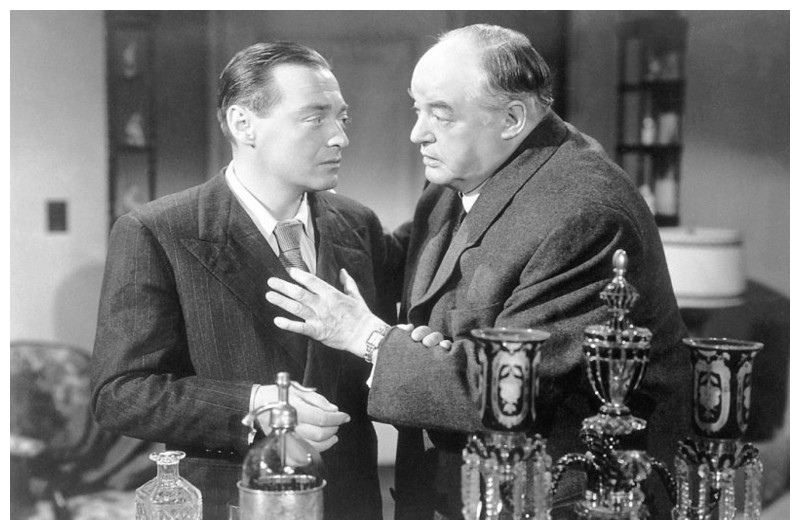
Where is `lamp`? The width and height of the screenshot is (800, 530). lamp is located at coordinates click(694, 323).